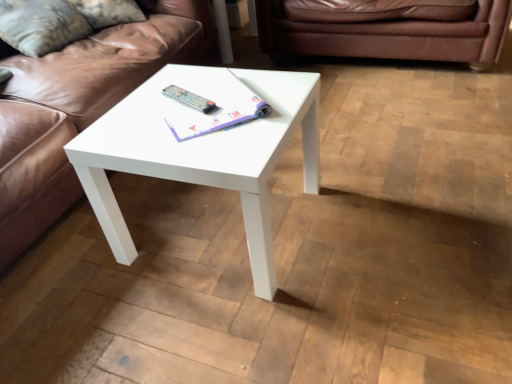
You are a GUI agent. You are given a task and a screenshot of the screen. Output one action in this format:
    pyautogui.click(x=<x>, y=<y>)
    Task: Click on the vacant space in front of white paper book at center
    The image size is (512, 384).
    Given the screenshot: What is the action you would take?
    pyautogui.click(x=209, y=147)